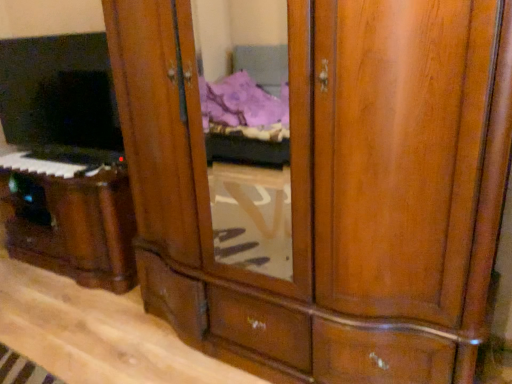
The height and width of the screenshot is (384, 512). Find the location of `free space in front of wooden piano at lower left`. free space in front of wooden piano at lower left is located at coordinates (69, 321).